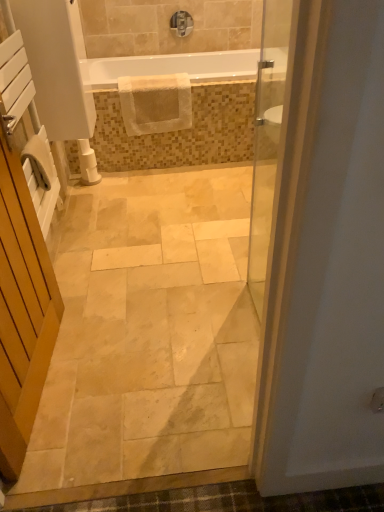
Identify the location of natural stone floor at center. This screenshot has height=512, width=384. (149, 333).

This screenshot has height=512, width=384. What do you see at coordinates (170, 67) in the screenshot? I see `white glossy bathtub at upper center` at bounding box center [170, 67].

The width and height of the screenshot is (384, 512). Describe the element at coordinates (22, 312) in the screenshot. I see `white wooden screen door at left` at that location.

Where is `matte silver faucet at upper center`? The width and height of the screenshot is (384, 512). matte silver faucet at upper center is located at coordinates (181, 23).

Which object is further away from the camera taking this photo, white wooden screen door at left or matte silver faucet at upper center?

matte silver faucet at upper center is further away from the camera.

Which of these two, white wooden screen door at left or matte silver faucet at upper center, is wider?

white wooden screen door at left is wider.

Is white wooden screen door at left not near matte silver faucet at upper center?

That's right, there is a large distance between white wooden screen door at left and matte silver faucet at upper center.

How different are the orientations of white glossy bathtub at upper center and natural stone floor at center in degrees?

There is a 0.694-degree angle between the facing directions of white glossy bathtub at upper center and natural stone floor at center.

Is white glossy bathtub at upper center turned away from natural stone floor at center?

No, white glossy bathtub at upper center is not facing away from natural stone floor at center.

Where is `bathtub on the right of natural stone floor at center`? Image resolution: width=384 pixels, height=512 pixels. bathtub on the right of natural stone floor at center is located at coordinates (170, 67).

Can we say white wooden screen door at left lies outside natural stone floor at center?

white wooden screen door at left lies outside natural stone floor at center's area.

Between white wooden screen door at left and natural stone floor at center, which one appears on the left side from the viewer's perspective?

white wooden screen door at left is more to the left.

Measure the distance from white wooden screen door at left to natural stone floor at center.

A distance of 50.00 centimeters exists between white wooden screen door at left and natural stone floor at center.

What's the angular difference between natural stone floor at center and white plastic toilet paper at lower left's facing directions?

natural stone floor at center and white plastic toilet paper at lower left are facing 92.3 degrees away from each other.

From the image's perspective, is natural stone floor at center below white plastic toilet paper at lower left?

Yes, from the image's perspective, natural stone floor at center is beneath white plastic toilet paper at lower left.

Can you confirm if natural stone floor at center is shorter than white plastic toilet paper at lower left?

Yes.

Is the position of white wooden screen door at left less distant than that of white textured mat at upper center?

That is True.

Is white wooden screen door at left not within white textured mat at upper center?

That's correct, white wooden screen door at left is outside of white textured mat at upper center.

Is white wooden screen door at left oriented towards white textured mat at upper center?

No, white wooden screen door at left is not turned towards white textured mat at upper center.

In the scene shown: How much distance is there between white wooden screen door at left and white textured mat at upper center?

white wooden screen door at left is 4.84 feet from white textured mat at upper center.

Based on the photo, is matte silver faucet at upper center in front of or behind white glossy bathtub at upper center in the image?

matte silver faucet at upper center is behind white glossy bathtub at upper center.

Choose the correct answer: Is matte silver faucet at upper center inside white glossy bathtub at upper center or outside it?

matte silver faucet at upper center cannot be found inside white glossy bathtub at upper center.

Is matte silver faucet at upper center positioned with its back to white glossy bathtub at upper center?

No, matte silver faucet at upper center's orientation is not away from white glossy bathtub at upper center.

Can you confirm if matte silver faucet at upper center is wider than white glossy bathtub at upper center?

No, matte silver faucet at upper center is not wider than white glossy bathtub at upper center.

In the scene shown: Does white textured mat at upper center appear on the left side of matte silver faucet at upper center?

Correct, you'll find white textured mat at upper center to the left of matte silver faucet at upper center.

You are a GUI agent. You are given a task and a screenshot of the screen. Output one action in this format:
    pyautogui.click(x=<x>, y=<y>)
    Task: Click on the material below the matte silver faucet at upper center (from a real-world perspective)
    This screenshot has width=384, height=512.
    Given the screenshot: What is the action you would take?
    pyautogui.click(x=155, y=103)

Is white textured mat at upper center positioned beyond the bounds of matte silver faucet at upper center?

That's correct, white textured mat at upper center is outside of matte silver faucet at upper center.

Does point (158, 78) lie in front of point (191, 30)?

Yes, it is in front of point (191, 30).

You are a GUI agent. You are given a task and a screenshot of the screen. Output one action in this format:
    pyautogui.click(x=<x>, y=<y>)
    Task: Click on the tap that appears on the right of white wooden screen door at left
    The height and width of the screenshot is (512, 384).
    Given the screenshot: What is the action you would take?
    pyautogui.click(x=181, y=23)

Where is `path below the white glossy bathtub at upper center (from the image's perspective)`? path below the white glossy bathtub at upper center (from the image's perspective) is located at coordinates (149, 333).

From the image, which object appears to be farther from white wooden screen door at left, white textured mat at upper center or white plastic toilet paper at lower left?

white plastic toilet paper at lower left.

From the image, which object appears to be nearer to matte silver faucet at upper center, white plastic toilet paper at lower left or natural stone floor at center?

Based on the image, white plastic toilet paper at lower left appears to be nearer to matte silver faucet at upper center.

Considering their positions, is natural stone floor at center positioned further to white glossy bathtub at upper center than white textured mat at upper center?

natural stone floor at center lies further to white glossy bathtub at upper center than the other object.

Estimate the real-world distances between objects in this image. Which object is closer to natural stone floor at center, white glossy bathtub at upper center or white plastic toilet paper at lower left?

white plastic toilet paper at lower left lies closer to natural stone floor at center than the other object.

Estimate the real-world distances between objects in this image. Which object is further from white glossy bathtub at upper center, natural stone floor at center or matte silver faucet at upper center?

natural stone floor at center is positioned further to the anchor white glossy bathtub at upper center.

Considering their positions, is white glossy bathtub at upper center positioned closer to white plastic toilet paper at lower left than matte silver faucet at upper center?

The object closer to white plastic toilet paper at lower left is white glossy bathtub at upper center.

Looking at the image, which one is located further to matte silver faucet at upper center, white textured mat at upper center or white wooden screen door at left?

white wooden screen door at left.

Considering their positions, is natural stone floor at center positioned further to white plastic toilet paper at lower left than white glossy bathtub at upper center?

natural stone floor at center lies further to white plastic toilet paper at lower left than the other object.

This screenshot has width=384, height=512. What are the coordinates of `material between white glossy bathtub at upper center and white plastic toilet paper at lower left from top to bottom` in the screenshot? It's located at 155,103.

At what (x,y) coordinates should I click in order to perform the action: click on bathtub between white wooden screen door at left and matte silver faucet at upper center from front to back. Please return your answer as a coordinate pair (x, y). The width and height of the screenshot is (384, 512). Looking at the image, I should click on (170, 67).

The height and width of the screenshot is (512, 384). I want to click on path between white wooden screen door at left and white textured mat at upper center in the front-back direction, so click(149, 333).

This screenshot has width=384, height=512. I want to click on bathtub between natural stone floor at center and matte silver faucet at upper center in the front-back direction, so click(170, 67).